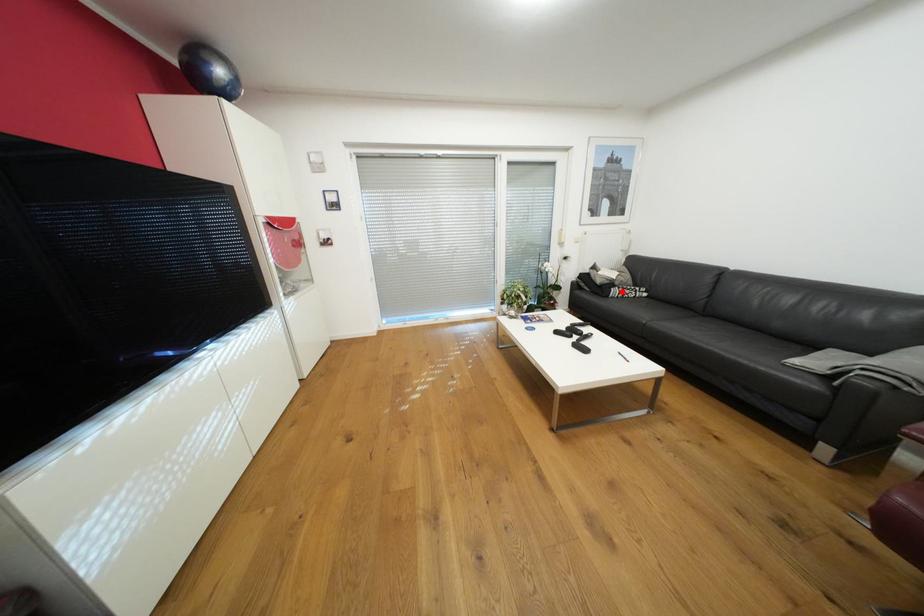
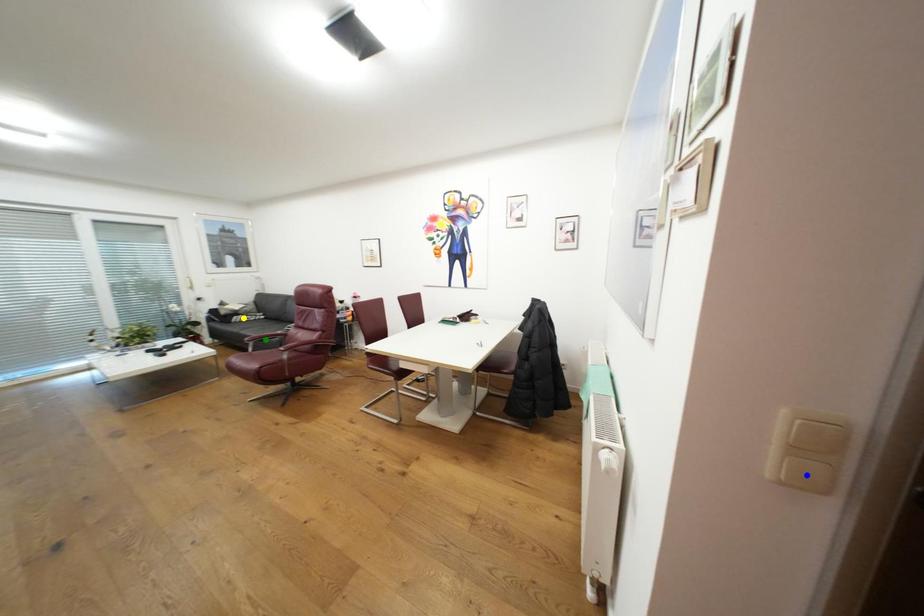
Question: I am providing you with two images of the same scene from different viewpoints. A red point is marked on the first image. You are given multiple points on the second image. Which spot in image 2 lines up with the point in image 1?

Choices:
 (A) green point
 (B) blue point
 (C) yellow point

Answer: (C)